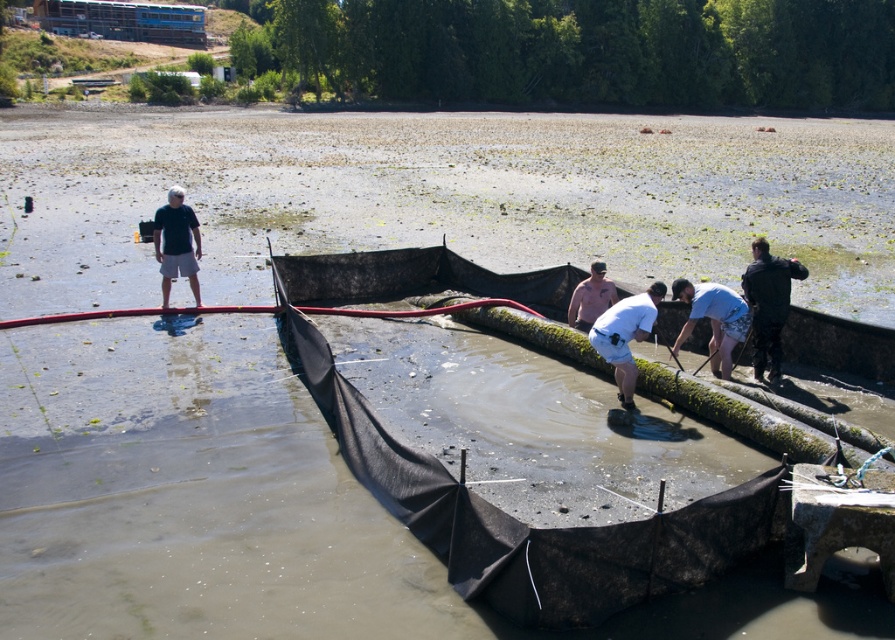
Who is more forward, (723, 300) or (594, 269)?

Point (723, 300) is in front.

Can you confirm if white matte shirt at lower right is shorter than pink matte shirt at center?

Incorrect, white matte shirt at lower right's height does not fall short of pink matte shirt at center's.

This screenshot has width=895, height=640. In order to click on white matte shirt at lower right in this screenshot , I will do `click(713, 320)`.

This screenshot has width=895, height=640. I want to click on dark matte wetsuit at right, so click(768, 304).

Measure the distance from dark matte wetsuit at right to white matte shorts at center.

They are 5.59 feet apart.

Who is more forward, (x=769, y=276) or (x=645, y=305)?

Point (x=645, y=305)

The width and height of the screenshot is (895, 640). I want to click on dark matte wetsuit at right, so click(768, 304).

Can you confirm if dark matte wetsuit at right is wider than matte black shirt at left?

Indeed, dark matte wetsuit at right has a greater width compared to matte black shirt at left.

Is dark matte wetsuit at right further to the viewer compared to matte black shirt at left?

No, it is not.

Where is `dark matte wetsuit at right`? This screenshot has width=895, height=640. dark matte wetsuit at right is located at coordinates pyautogui.click(x=768, y=304).

At what (x,y) coordinates should I click in order to perform the action: click on dark matte wetsuit at right. Please return your answer as a coordinate pair (x, y). The height and width of the screenshot is (640, 895). Looking at the image, I should click on (768, 304).